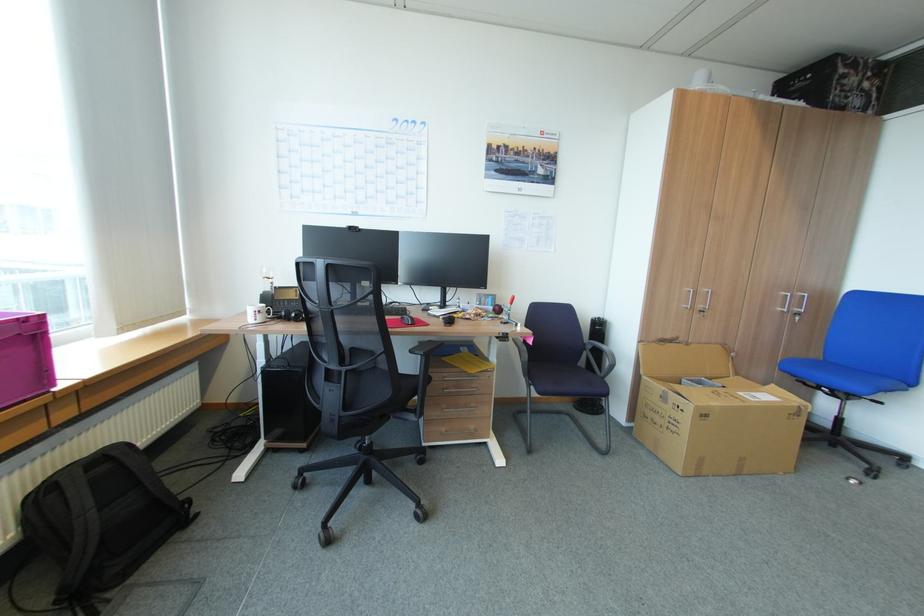
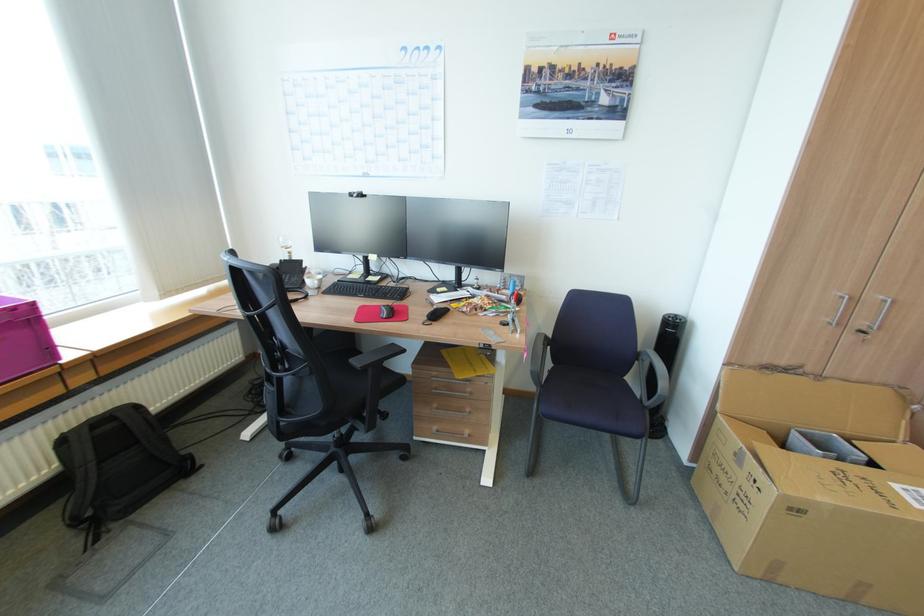
Find the pixel in the second image that matches (477,387) in the first image.

(469, 392)